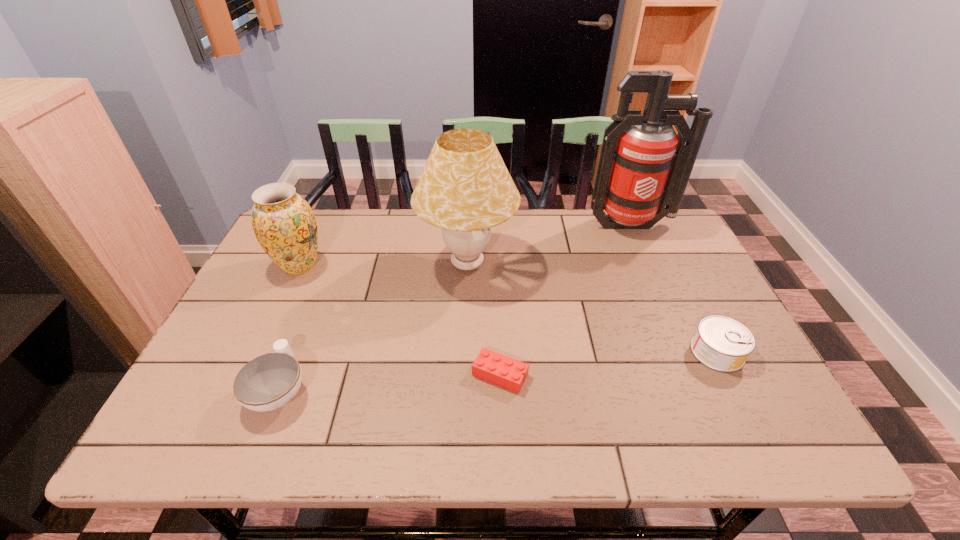
The height and width of the screenshot is (540, 960). In order to click on the tallest object in this screenshot , I will do pyautogui.click(x=644, y=165).

At what (x,y) coordinates should I click in order to perform the action: click on the fifth shortest object. Please return your answer as a coordinate pair (x, y). Looking at the image, I should click on (465, 188).

This screenshot has width=960, height=540. I want to click on vase, so click(284, 224).

You are a GUI agent. You are given a task and a screenshot of the screen. Output one action in this format:
    pyautogui.click(x=<x>, y=<y>)
    Task: Click on the chinaware
    The image size is (960, 540).
    Given the screenshot: What is the action you would take?
    pyautogui.click(x=269, y=381)

The width and height of the screenshot is (960, 540). Identify the location of can. (723, 344).

Where is `Lego`? The width and height of the screenshot is (960, 540). Lego is located at coordinates (498, 369).

Where is `vacant region located 0.260m on the front label side of the fire extinguisher`? vacant region located 0.260m on the front label side of the fire extinguisher is located at coordinates (664, 301).

Where is `blank space located on the right of the second tallest object`? This screenshot has width=960, height=540. blank space located on the right of the second tallest object is located at coordinates (554, 264).

Identify the location of blank space located 0.220m on the front of the vase. This screenshot has height=540, width=960. (261, 347).

In order to click on vacant area located 0.130m on the side with the handle of the chinaware in this screenshot , I will do `click(308, 318)`.